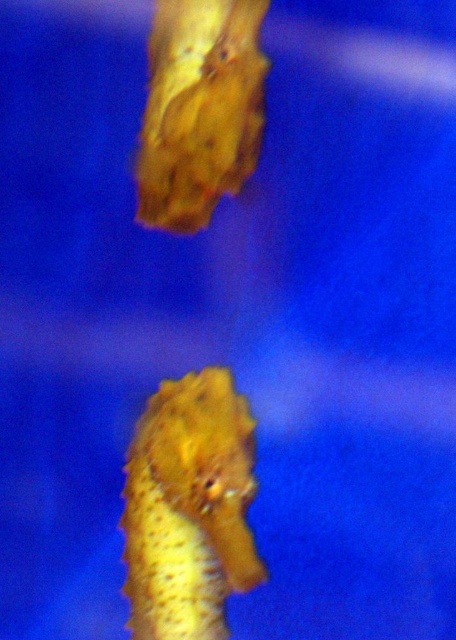
What do you see at coordinates (190, 508) in the screenshot? I see `yellow matte seahorse at center` at bounding box center [190, 508].

Does point (159, 390) come behind point (242, 164)?

Yes, it is behind point (242, 164).

Find the location of `yellow matte seahorse at center`. yellow matte seahorse at center is located at coordinates (190, 508).